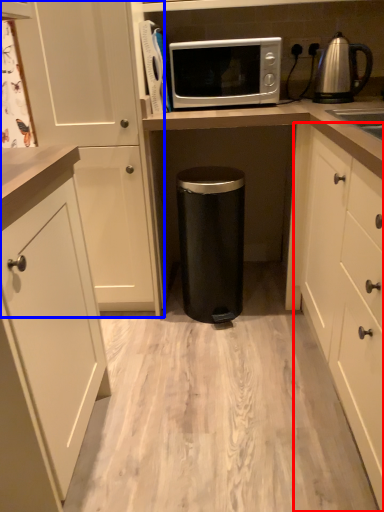
Question: Which object appears farthest to the camera in this image, cabinetry (highlighted by a red box) or cabinetry (highlighted by a blue box)?

Choices:
 (A) cabinetry
 (B) cabinetry

Answer: (B)